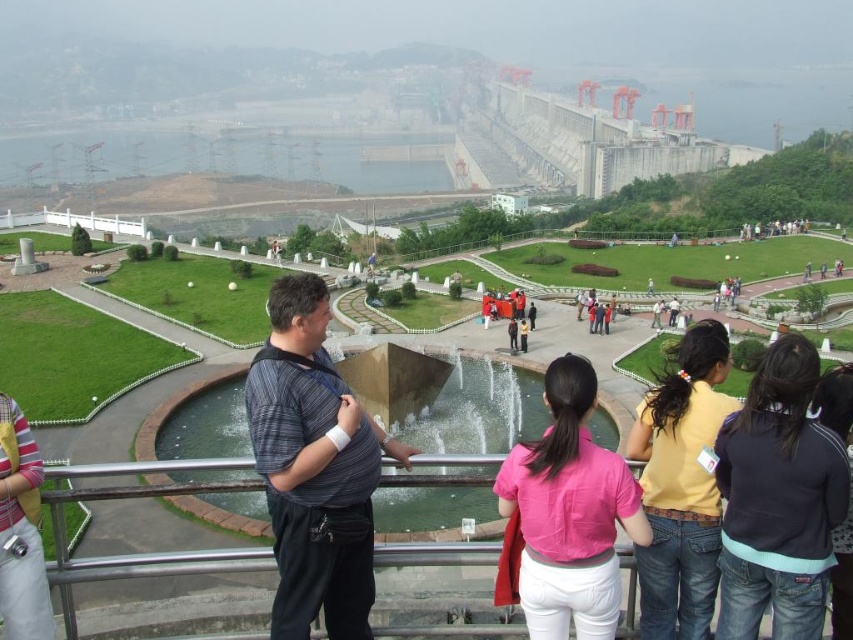
Which is below, striped fabric baby carrier at center or black fleece jacket at lower right?

black fleece jacket at lower right

Is point (300, 332) positioned after point (848, 484)?

Yes, point (300, 332) is behind point (848, 484).

Who is more distant from viewer, (292, 292) or (836, 630)?

Point (292, 292)

Identify the location of striped fabric baby carrier at center. (314, 467).

Which of these two, dark gray sweatshirt at lower right or yellow denim jeans at lower right, stands taller?

With more height is yellow denim jeans at lower right.

Between point (786, 387) and point (660, 544), which one is positioned behind?

Positioned behind is point (660, 544).

Image resolution: width=853 pixels, height=640 pixels. In order to click on dark gray sweatshirt at lower right in this screenshot , I will do `click(778, 499)`.

The image size is (853, 640). What are the coordinates of `brushed metal camera at lower left` in the screenshot? It's located at (20, 531).

Is point (18, 536) closer to viewer compared to point (844, 588)?

Yes, point (18, 536) is closer to viewer.

What do you see at coordinates (20, 531) in the screenshot? I see `brushed metal camera at lower left` at bounding box center [20, 531].

Identify the location of brushed metal camera at lower left. click(20, 531).